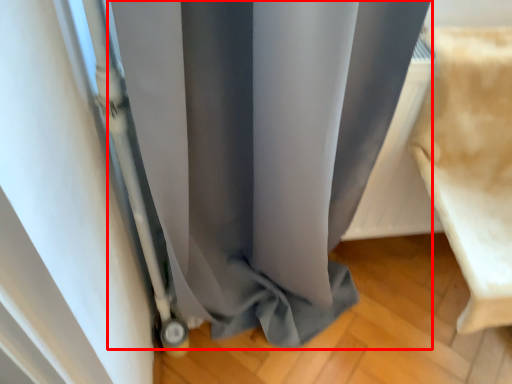
Question: From the image's perspective, what is the correct spatial relationship of curtain (annotated by the red box) in relation to furniture?

Choices:
 (A) below
 (B) above

Answer: (A)